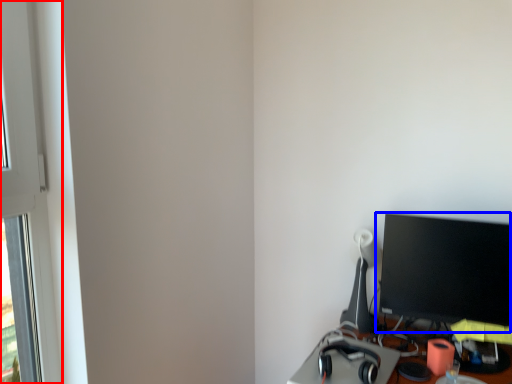
Question: Which of the following is the farthest to the observer, window frame (highlighted by a red box) or computer monitor (highlighted by a blue box)?

Choices:
 (A) window frame
 (B) computer monitor

Answer: (B)